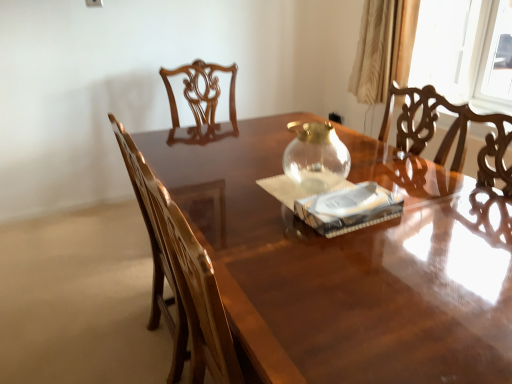
In order to click on glossy wood chair at left in this screenshot , I will do `click(181, 277)`.

What do you see at coordinates (383, 48) in the screenshot?
I see `beige satin curtain at upper right` at bounding box center [383, 48].

Locate an element on the screen. This screenshot has height=384, width=512. glossy wood table at center is located at coordinates (349, 264).

From the image's perspective, relative to glossy wood table at center, is glossy wood chair at left above or below?

Clearly, from the image's perspective, glossy wood chair at left is above glossy wood table at center.

The image size is (512, 384). Identify the location of table located underneath the glossy wood chair at left (from a real-world perspective). (349, 264).

Could you tell me if beige satin curtain at upper right is turned towards glossy wood chair at left?

Yes, beige satin curtain at upper right is turned towards glossy wood chair at left.

Considering the points (390, 12) and (186, 299), which point is in front, point (390, 12) or point (186, 299)?

The point (186, 299) is closer.

From their relative heights in the image, would you say beige satin curtain at upper right is taller or shorter than glossy wood chair at left?

In the image, beige satin curtain at upper right appears to be shorter than glossy wood chair at left.

This screenshot has height=384, width=512. Find the location of `curtain that appears above the glossy wood chair at left (from the image's perspective)`. curtain that appears above the glossy wood chair at left (from the image's perspective) is located at coordinates (383, 48).

From a real-world perspective, which is physically below, glossy wood chair at left or beige satin curtain at upper right?

glossy wood chair at left, from a real-world perspective.

Considering the relative positions of glossy wood chair at left and beige satin curtain at upper right in the image provided, is glossy wood chair at left to the left or to the right of beige satin curtain at upper right?

glossy wood chair at left is positioned on beige satin curtain at upper right's left side.

Considering the sizes of beige satin curtain at upper right and glossy wood table at center in the image, is beige satin curtain at upper right bigger or smaller than glossy wood table at center?

Considering their sizes, beige satin curtain at upper right takes up less space than glossy wood table at center.

In terms of width, does beige satin curtain at upper right look wider or thinner when compared to glossy wood table at center?

Clearly, beige satin curtain at upper right has less width compared to glossy wood table at center.

Does beige satin curtain at upper right appear on the left side of glossy wood table at center?

No, beige satin curtain at upper right is not to the left of glossy wood table at center.

From the image's perspective, which is above, beige satin curtain at upper right or glossy wood table at center?

beige satin curtain at upper right is shown above in the image.

Is glossy wood chair at left turned away from white paper at center?

No, glossy wood chair at left is not facing the opposite direction of white paper at center.

The height and width of the screenshot is (384, 512). I want to click on paperback book located above the glossy wood chair at left (from the image's perspective), so click(x=349, y=209).

Which is less distant, (x=192, y=265) or (x=358, y=225)?

The point (x=192, y=265) is more forward.

From the image's perspective, between glossy wood chair at left and white paper at center, who is located below?

glossy wood chair at left appears lower in the image.

Is transparent glass teapot at center touching beige satin curtain at upper right?

No.

From the picture: From a real-world perspective, between transparent glass teapot at center and beige satin curtain at upper right, who is vertically lower?

From a 3D spatial view, transparent glass teapot at center is below.

Which is correct: transparent glass teapot at center is inside beige satin curtain at upper right, or outside of it?

transparent glass teapot at center is not inside beige satin curtain at upper right, it's outside.

Based on their sizes in the image, would you say transparent glass teapot at center is bigger or smaller than beige satin curtain at upper right?

In the image, transparent glass teapot at center appears to be smaller than beige satin curtain at upper right.

Is there a large distance between transparent glass teapot at center and glossy wood chair at left?

That's not correct — transparent glass teapot at center is a little close to glossy wood chair at left.

Considering the sizes of objects transparent glass teapot at center and glossy wood chair at left in the image provided, who is wider, transparent glass teapot at center or glossy wood chair at left?

With larger width is glossy wood chair at left.

Which object is further away from the camera taking this photo, transparent glass teapot at center or glossy wood chair at left?

transparent glass teapot at center is behind.

Is transparent glass teapot at center taller than glossy wood chair at left?

No, transparent glass teapot at center is not taller than glossy wood chair at left.

Locate an element on the screen. Image resolution: width=512 pixels, height=384 pixels. chair located above the glossy wood table at center (from the image's perspective) is located at coordinates (181, 277).

Identify the location of chair on the left of the beige satin curtain at upper right. The height and width of the screenshot is (384, 512). (181, 277).

Estimate the real-world distances between objects in this image. Which object is further from glossy wood table at center, white paper at center or transparent glass teapot at center?

The object further to glossy wood table at center is transparent glass teapot at center.

Looking at the image, which one is located further to glossy wood chair at left, transparent glass teapot at center or glossy wood table at center?

Based on the image, transparent glass teapot at center appears to be further to glossy wood chair at left.

From the image, which object appears to be farther from white paper at center, glossy wood table at center or beige satin curtain at upper right?

beige satin curtain at upper right is positioned further to the anchor white paper at center.

From the image, which object appears to be farther from glossy wood chair at left, beige satin curtain at upper right or transparent glass teapot at center?

beige satin curtain at upper right is positioned further to the anchor glossy wood chair at left.

Looking at this image, estimate the real-world distances between objects in this image. Which object is further from white paper at center, transparent glass teapot at center or glossy wood table at center?

transparent glass teapot at center lies further to white paper at center than the other object.

From the picture: Based on their spatial positions, is glossy wood table at center or white paper at center further from glossy wood chair at left?

The object further to glossy wood chair at left is white paper at center.

Looking at the image, which one is located closer to transparent glass teapot at center, glossy wood table at center or glossy wood chair at left?

glossy wood table at center is positioned closer to the anchor transparent glass teapot at center.

From the image, which object appears to be farther from transparent glass teapot at center, white paper at center or glossy wood chair at left?

glossy wood chair at left lies further to transparent glass teapot at center than the other object.

Where is `paperback book between glossy wood table at center and transparent glass teapot at center from front to back`? paperback book between glossy wood table at center and transparent glass teapot at center from front to back is located at coordinates (349, 209).

You are a GUI agent. You are given a task and a screenshot of the screen. Output one action in this format:
    pyautogui.click(x=<x>, y=<y>)
    Task: Click on the paperback book located between glossy wood chair at left and beige satin curtain at upper right in the depth direction
    Image resolution: width=512 pixels, height=384 pixels.
    Given the screenshot: What is the action you would take?
    pyautogui.click(x=349, y=209)

Identify the location of glass vase located between glossy wood chair at left and beige satin curtain at upper right in the depth direction. Image resolution: width=512 pixels, height=384 pixels. (315, 157).

Identify the location of glass vase between white paper at center and beige satin curtain at upper right from front to back. (315, 157).